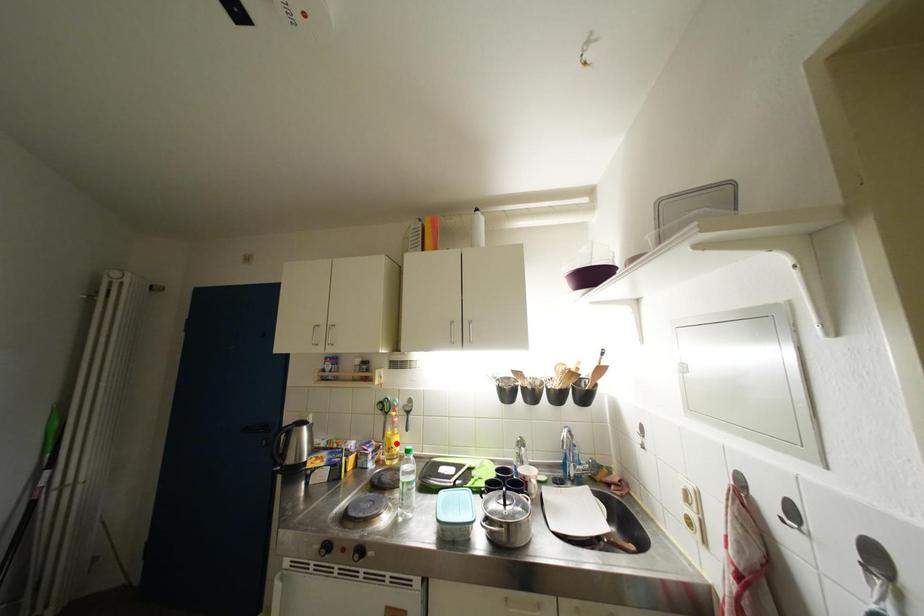
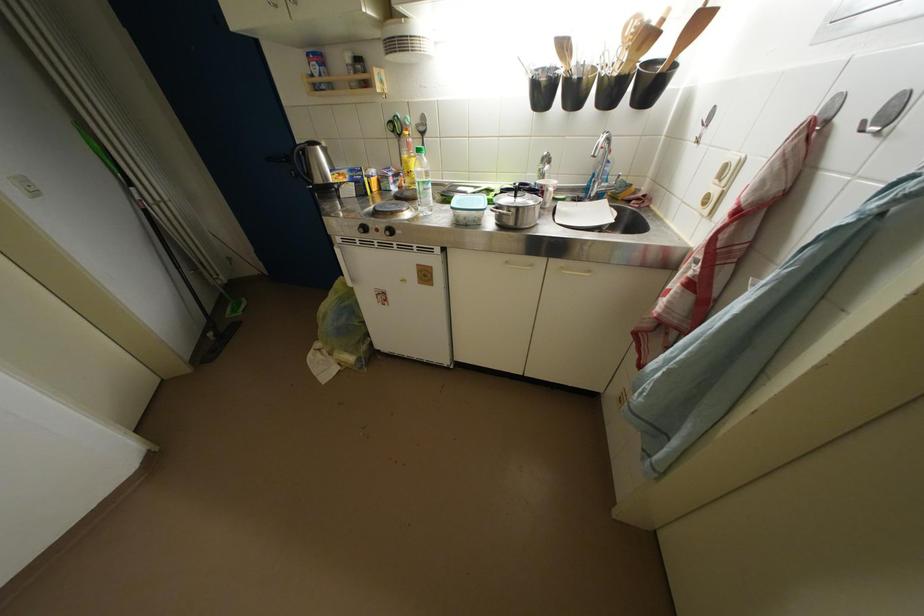
Locate, in the second image, the point that corresponds to the highlighted location in the first image.

(412, 167)